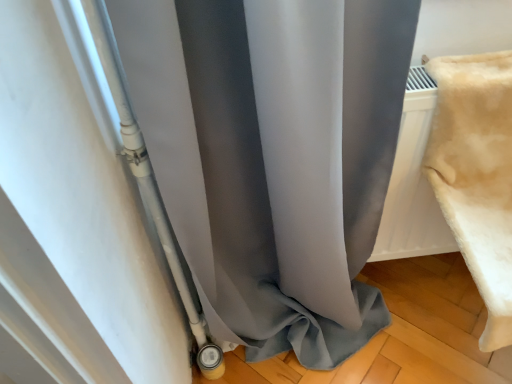
Question: Is beige plush blanket at right bigger or smaller than matte gray curtain at center?

Choices:
 (A) small
 (B) big

Answer: (A)

Question: Would you say beige plush blanket at right is to the left or to the right of matte gray curtain at center in the picture?

Choices:
 (A) right
 (B) left

Answer: (A)

Question: From the image's perspective, is beige plush blanket at right above or below matte gray curtain at center?

Choices:
 (A) below
 (B) above

Answer: (B)

Question: Visually, is matte gray curtain at center positioned to the left or to the right of beige plush blanket at right?

Choices:
 (A) left
 (B) right

Answer: (A)

Question: From a real-world perspective, is matte gray curtain at center physically located above or below beige plush blanket at right?

Choices:
 (A) below
 (B) above

Answer: (A)

Question: Based on their sizes in the image, would you say matte gray curtain at center is bigger or smaller than beige plush blanket at right?

Choices:
 (A) small
 (B) big

Answer: (B)

Question: Considering their positions, is matte gray curtain at center located in front of or behind beige plush blanket at right?

Choices:
 (A) behind
 (B) front

Answer: (B)